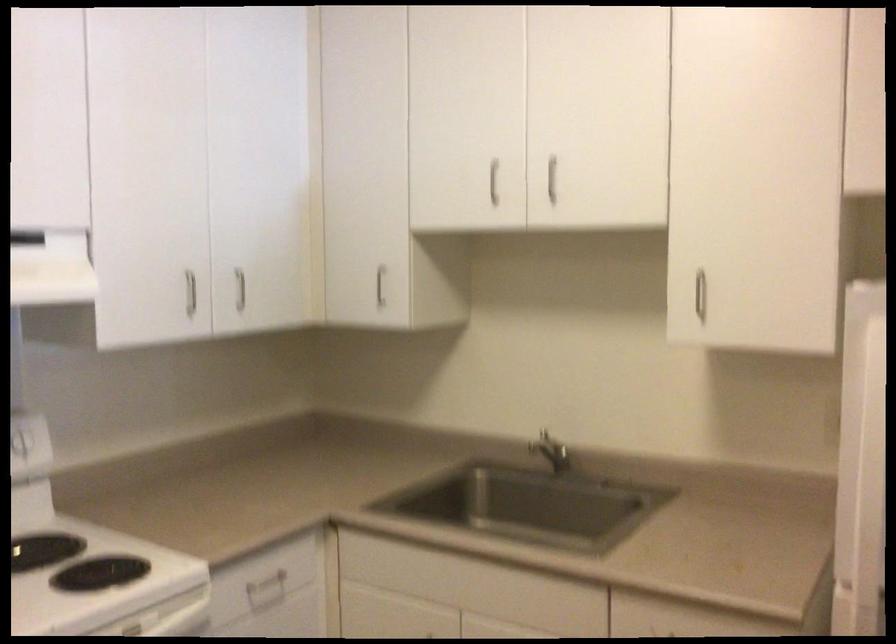
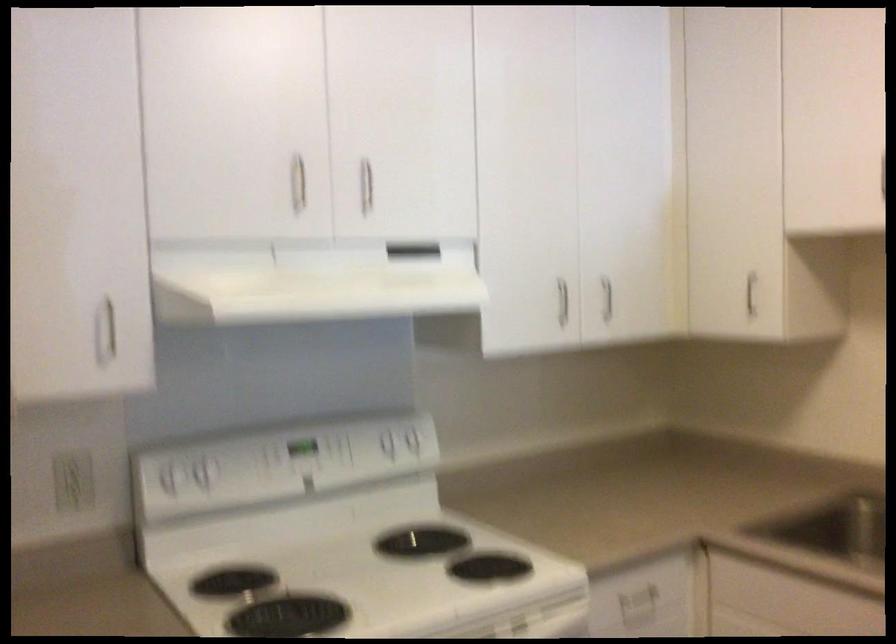
The point at [188,287] is marked in the first image. Where is the corresponding point in the second image?

(562, 301)